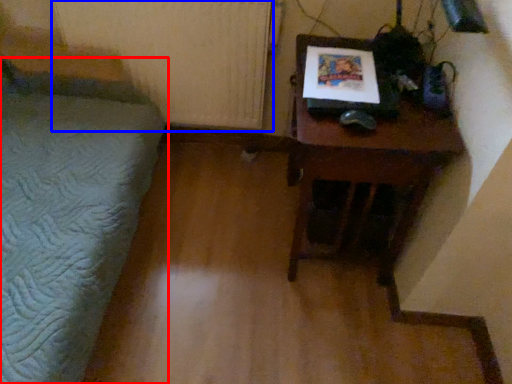
Question: Which point is closer to the camera, furniture (highlighted by a red box) or radiator (highlighted by a blue box)?

Choices:
 (A) furniture
 (B) radiator

Answer: (A)